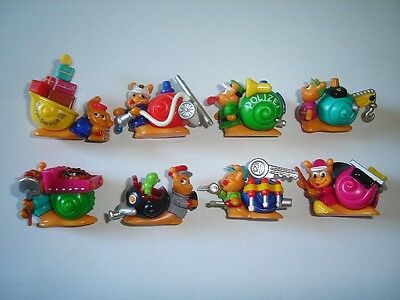
Where is `toy figurines`? toy figurines is located at coordinates (94, 122), (83, 195), (168, 202), (176, 133), (284, 121), (256, 181), (324, 184), (323, 114).